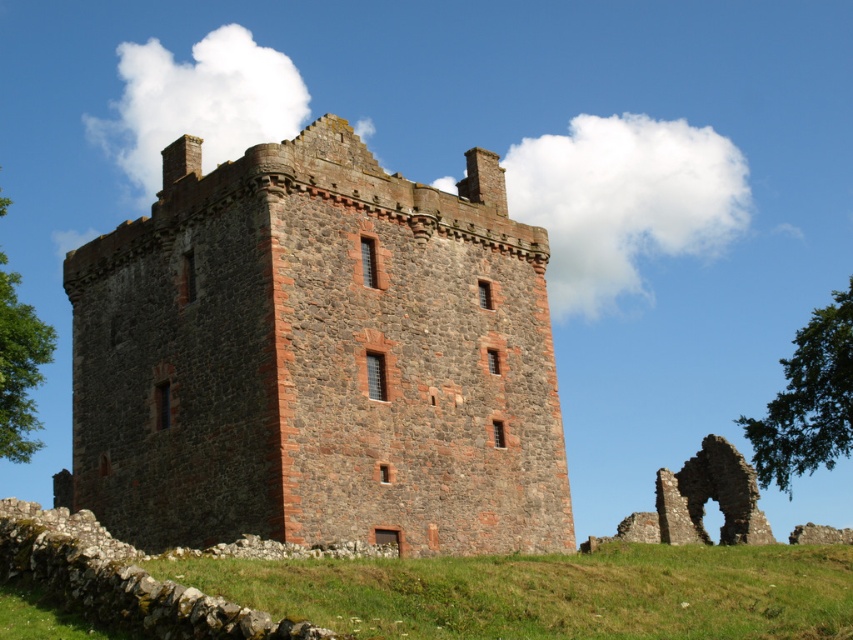
You are standing at the entrance of the historic stone building and see the point marked at coordinates (x=318, y=356). Based on the scene description, what object or architectural feature does this point most likely represent?

The point at coordinates (x=318, y=356) corresponds to the rustic stone tower at center, as indicated in the objects description.

You are standing in front of the historic stone building and notice two points marked on the structure. One is at coordinate point (505, 216) and the other at point (833, 420). Which point is nearer to your current position?

Point (505, 216) is closer to the camera than point (833, 420), so the point at (505, 216) is nearer to your current position.